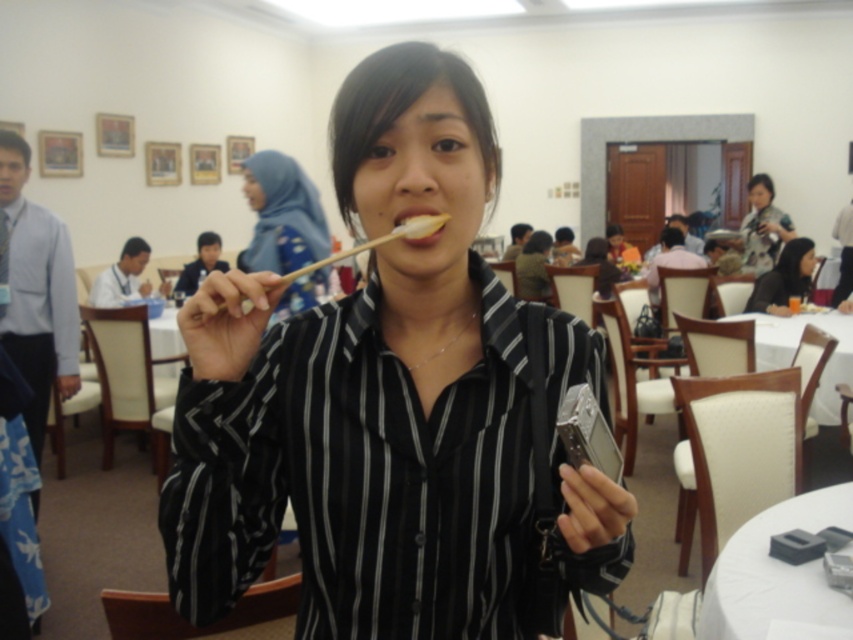
Can you confirm if black striped shirt at center is wider than blue fabric hijab at upper center?

No, black striped shirt at center is not wider than blue fabric hijab at upper center.

Which is above, black striped shirt at center or blue fabric hijab at upper center?

Positioned higher is blue fabric hijab at upper center.

Find the location of a particular element. The image size is (853, 640). black striped shirt at center is located at coordinates (392, 404).

Is patterned fabric scarf at upper right to the left of black fabric shirt at center from the viewer's perspective?

Incorrect, patterned fabric scarf at upper right is not on the left side of black fabric shirt at center.

Does point (753, 193) come closer to viewer compared to point (793, 253)?

No, (753, 193) is behind (793, 253).

Identify the location of patterned fabric scarf at upper right. This screenshot has width=853, height=640. (762, 227).

Can you confirm if blue fabric hijab at upper center is positioned below black fabric shirt at center?

No, blue fabric hijab at upper center is not below black fabric shirt at center.

Which is in front, point (241, 262) or point (769, 300)?

Point (241, 262) is in front.

What are the coordinates of `blue fabric hijab at upper center` in the screenshot? It's located at (281, 216).